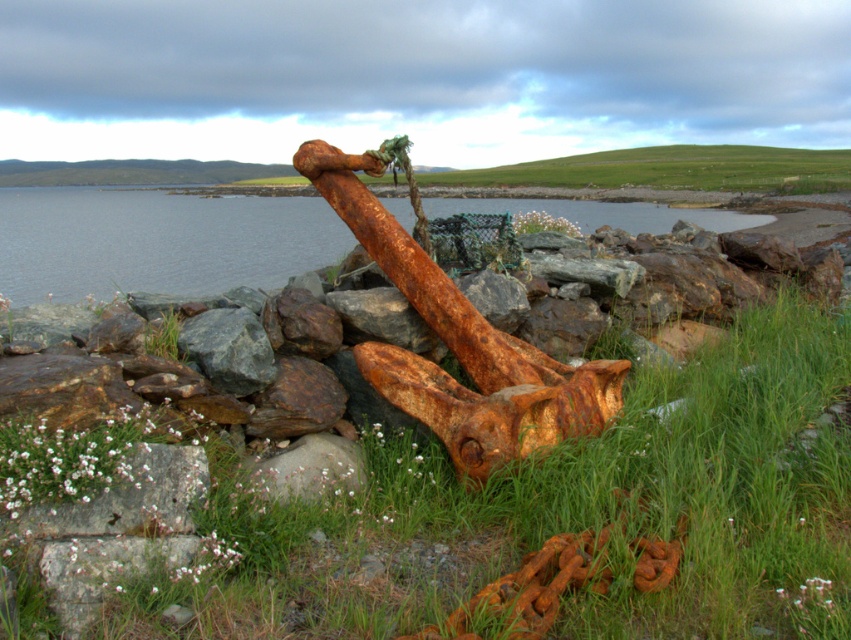
Question: Which object is farther from the camera taking this photo?

Choices:
 (A) green grass at center
 (B) rusty metallic water at center

Answer: (B)

Question: Which point is closer to the camera taking this photo?

Choices:
 (A) (187, 259)
 (B) (585, 632)

Answer: (B)

Question: Does green grass at center appear under rusty metallic water at center?

Choices:
 (A) yes
 (B) no

Answer: (A)

Question: Is green grass at center smaller than rusty metallic water at center?

Choices:
 (A) yes
 (B) no

Answer: (A)

Question: Considering the relative positions of green grass at center and rusty metallic water at center in the image provided, where is green grass at center located with respect to rusty metallic water at center?

Choices:
 (A) below
 (B) above

Answer: (A)

Question: Which of the following is the farthest from the observer?

Choices:
 (A) green grass at center
 (B) rusty metallic water at center

Answer: (B)